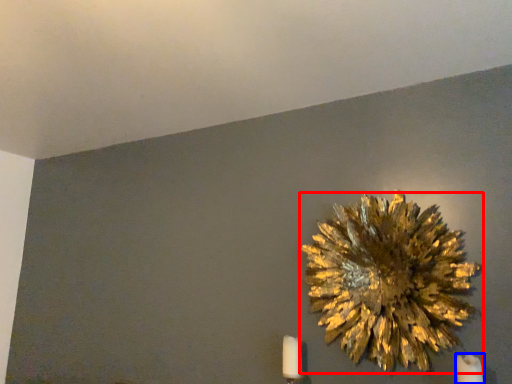
Question: Which of the following is the farthest to the observer, flower (highlighted by a red box) or candle (highlighted by a blue box)?

Choices:
 (A) flower
 (B) candle

Answer: (A)